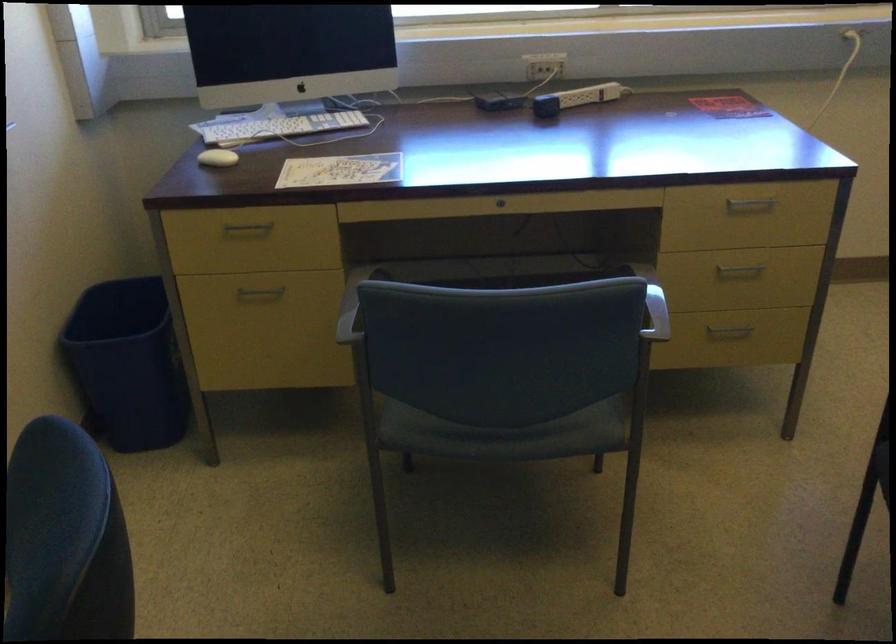
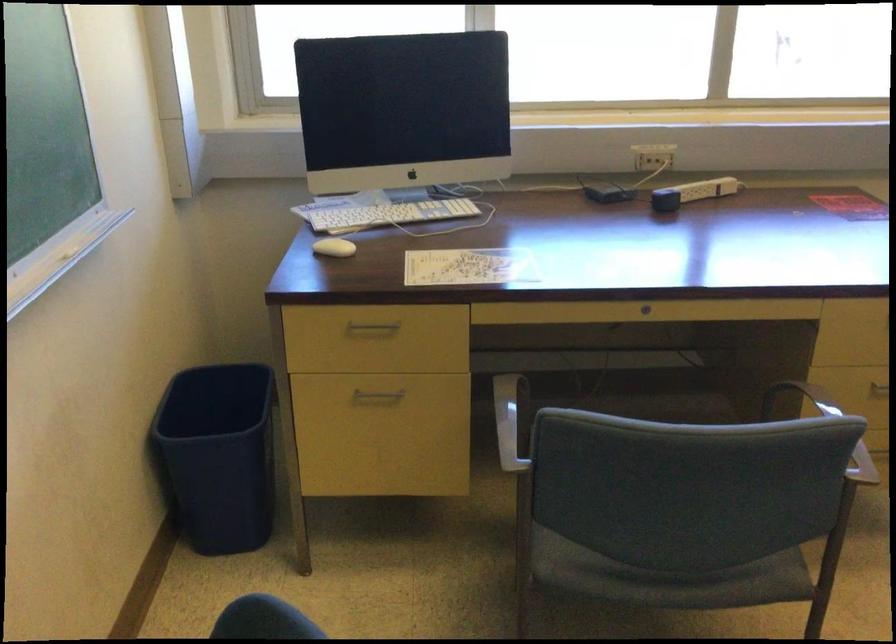
In the second image, find the point that corresponds to (x=262, y=295) in the first image.

(376, 395)